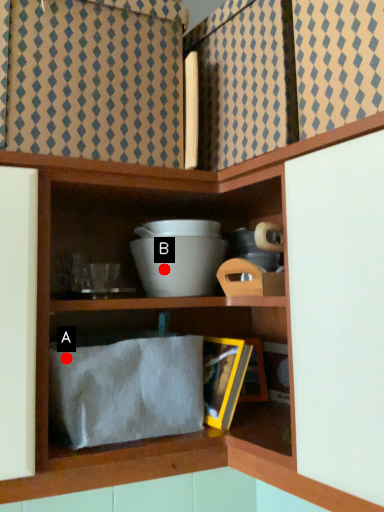
Question: Two points are circled on the image, labeled by A and B beside each circle. Which point is farther to the camera?

Choices:
 (A) A is further
 (B) B is further

Answer: (B)